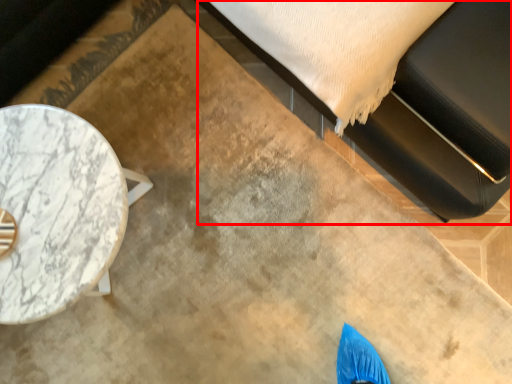
Question: Where is bed (annotated by the red box) located in relation to table in the image?

Choices:
 (A) right
 (B) left

Answer: (A)